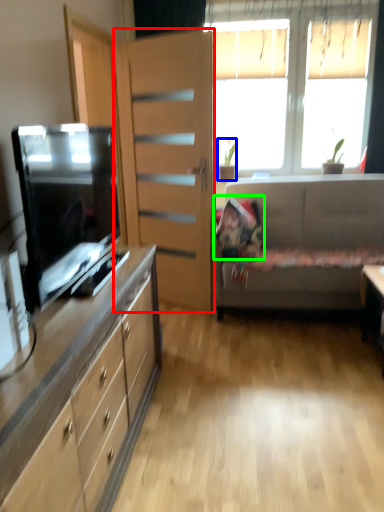
Question: Considering the real-world distances, which object is farthest from file cabinet (highlighted by a red box)? houseplant (highlighted by a blue box) or pillow (highlighted by a green box)?

Choices:
 (A) houseplant
 (B) pillow

Answer: (A)